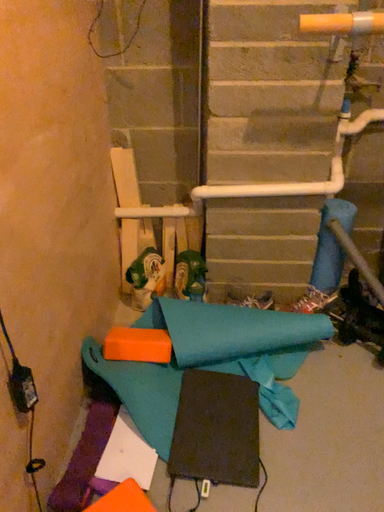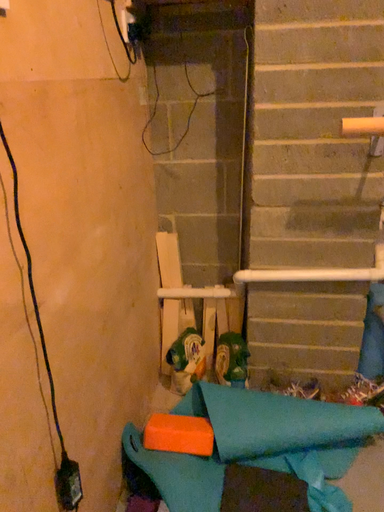
Question: Which way did the camera rotate in the video?

Choices:
 (A) rotated downward
 (B) rotated upward

Answer: (B)